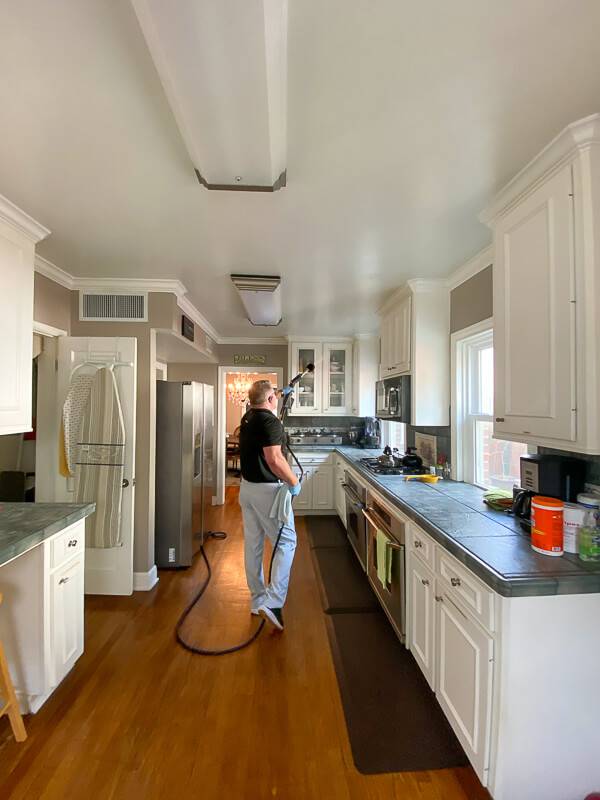
Find the location of a particular element. The image size is (600, 800). microwave is located at coordinates (382, 400).